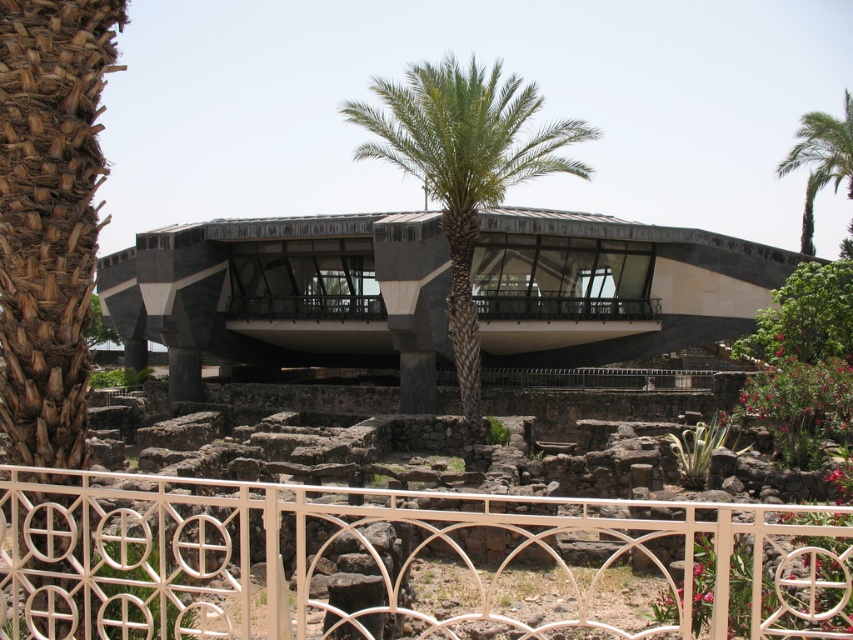
Who is higher up, white metal fence at lower center or green leafy palm tree at upper right?

Positioned higher is green leafy palm tree at upper right.

The height and width of the screenshot is (640, 853). What are the coordinates of `white metal fence at lower center` in the screenshot? It's located at (395, 561).

Can you confirm if white metal fence at lower center is thinner than green leafy tree at upper right?

No, white metal fence at lower center is not thinner than green leafy tree at upper right.

Does white metal fence at lower center appear on the left side of green leafy tree at upper right?

Yes, white metal fence at lower center is to the left of green leafy tree at upper right.

At what (x,y) coordinates should I click in order to perform the action: click on white metal fence at lower center. Please return your answer as a coordinate pair (x, y). This screenshot has width=853, height=640. Looking at the image, I should click on (395, 561).

At what (x,y) coordinates should I click in order to perform the action: click on white metal fence at lower center. Please return your answer as a coordinate pair (x, y). This screenshot has width=853, height=640. Looking at the image, I should click on (395, 561).

Who is more forward, (431, 173) or (840, 349)?

Point (431, 173) is more forward.

Looking at this image, does green leafy palm tree at center have a greater width compared to green leafy tree at upper right?

Correct, the width of green leafy palm tree at center exceeds that of green leafy tree at upper right.

Is point (376, 145) closer to viewer compared to point (772, 358)?

No, it is not.

Locate an element on the screen. The image size is (853, 640). green leafy palm tree at center is located at coordinates (463, 168).